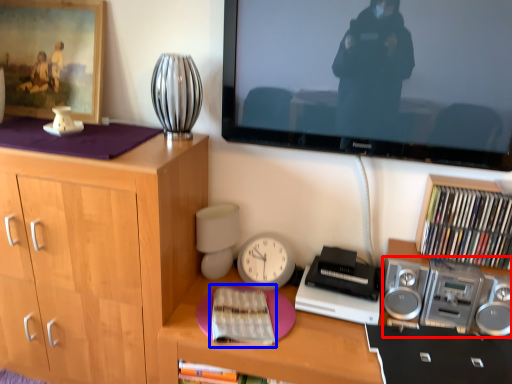
Question: Which object appears closest to the camera in this image, stereo (highlighted by a red box) or book (highlighted by a blue box)?

Choices:
 (A) stereo
 (B) book

Answer: (B)